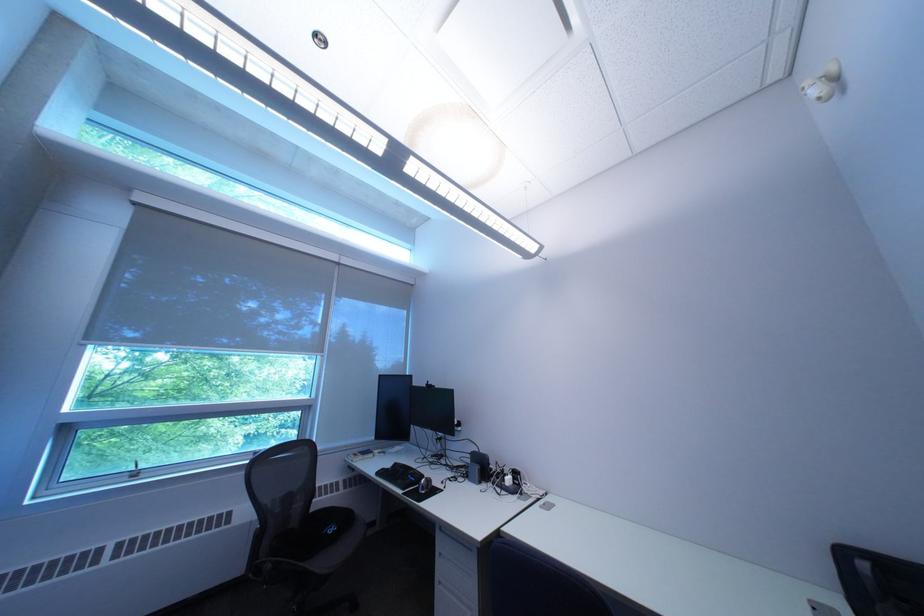
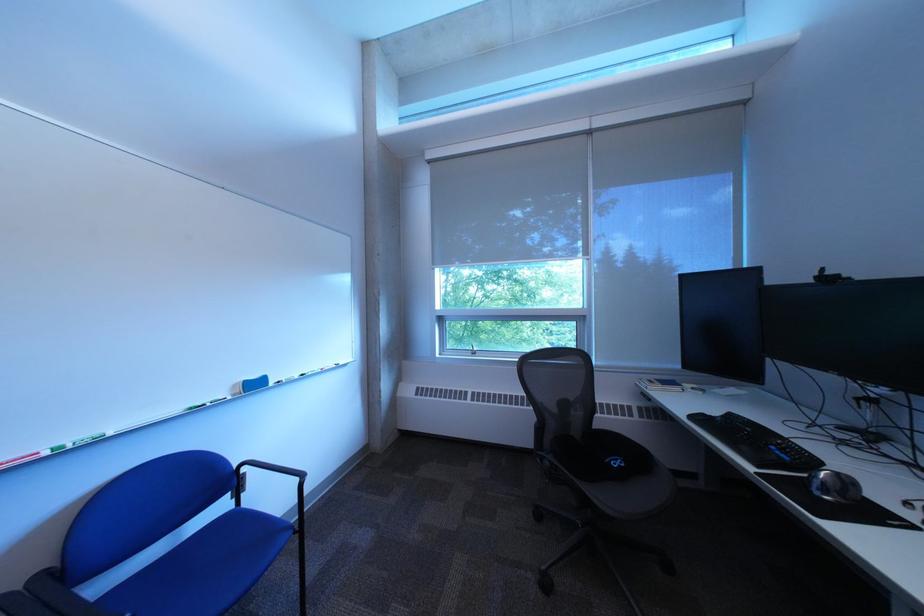
The point at (393, 475) is marked in the first image. Where is the corresponding point in the second image?

(708, 419)